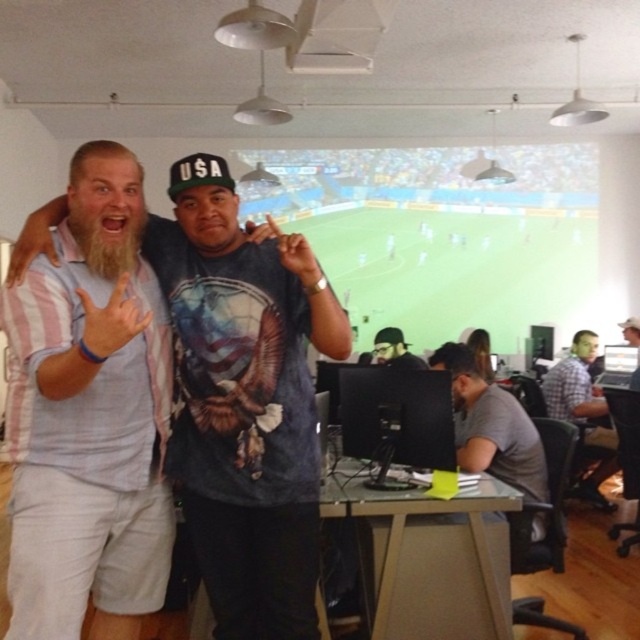
You are a photographer trying to capture a group photo of the light blue striped shirt at center and the plaid shirt at right. If your camera has a maximum focus range of 3 meters, will you be able to capture both subjects clearly in the same frame?

The distance between the light blue striped shirt at center and the plaid shirt at right is 3.65 meters. Since the camera can only focus up to 3 meters, the subjects are too far apart for both to be in clear focus simultaneously.

You are taking a photo of the white striped shirt at left and the dark gray knit cap at center. Which object will appear larger in your photo?

The white striped shirt at left appears larger in the photo because it is closer to the viewer than the dark gray knit cap at center.